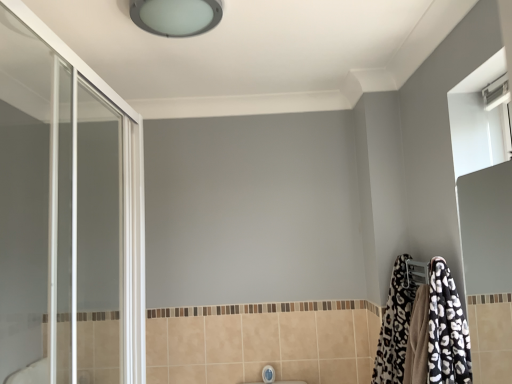
Question: From a real-world perspective, does white glossy faucet at lower center stand above satin white ceiling light at upper center?

Choices:
 (A) no
 (B) yes

Answer: (A)

Question: Can you confirm if white glossy faucet at lower center is smaller than satin white ceiling light at upper center?

Choices:
 (A) no
 (B) yes

Answer: (B)

Question: From the image's perspective, would you say white glossy faucet at lower center is shown under satin white ceiling light at upper center?

Choices:
 (A) yes
 (B) no

Answer: (A)

Question: Are white glossy faucet at lower center and satin white ceiling light at upper center beside each other?

Choices:
 (A) no
 (B) yes

Answer: (A)

Question: Is white glossy faucet at lower center oriented towards satin white ceiling light at upper center?

Choices:
 (A) yes
 (B) no

Answer: (B)

Question: Considering the relative positions of white glossy faucet at lower center and satin white ceiling light at upper center in the image provided, is white glossy faucet at lower center to the left of satin white ceiling light at upper center from the viewer's perspective?

Choices:
 (A) no
 (B) yes

Answer: (A)

Question: From the image's perspective, is black and white leopard print bathrobe at lower right below transparent glass screen door at left?

Choices:
 (A) yes
 (B) no

Answer: (A)

Question: Is black and white leopard print bathrobe at lower right further to the viewer compared to transparent glass screen door at left?

Choices:
 (A) yes
 (B) no

Answer: (A)

Question: Is black and white leopard print bathrobe at lower right touching transparent glass screen door at left?

Choices:
 (A) no
 (B) yes

Answer: (A)

Question: Would you say black and white leopard print bathrobe at lower right is a long distance from transparent glass screen door at left?

Choices:
 (A) yes
 (B) no

Answer: (A)

Question: Is black and white leopard print bathrobe at lower right to the right of transparent glass screen door at left from the viewer's perspective?

Choices:
 (A) no
 (B) yes

Answer: (B)

Question: Considering the relative sizes of black and white leopard print bathrobe at lower right and transparent glass screen door at left in the image provided, is black and white leopard print bathrobe at lower right thinner than transparent glass screen door at left?

Choices:
 (A) no
 (B) yes

Answer: (A)

Question: Could black and white leopard print bathrobe at lower right be considered to be inside transparent glass screen door at left?

Choices:
 (A) no
 (B) yes

Answer: (A)